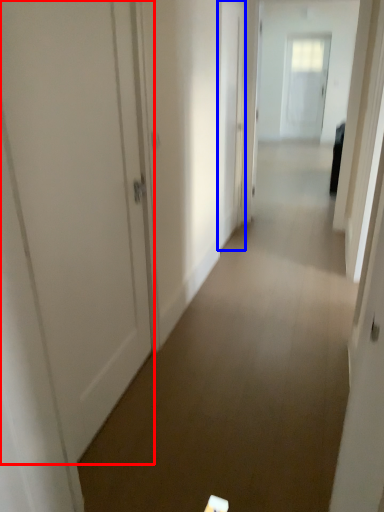
Question: Which of the following is the closest to the observer, door (highlighted by a red box) or door (highlighted by a blue box)?

Choices:
 (A) door
 (B) door

Answer: (A)